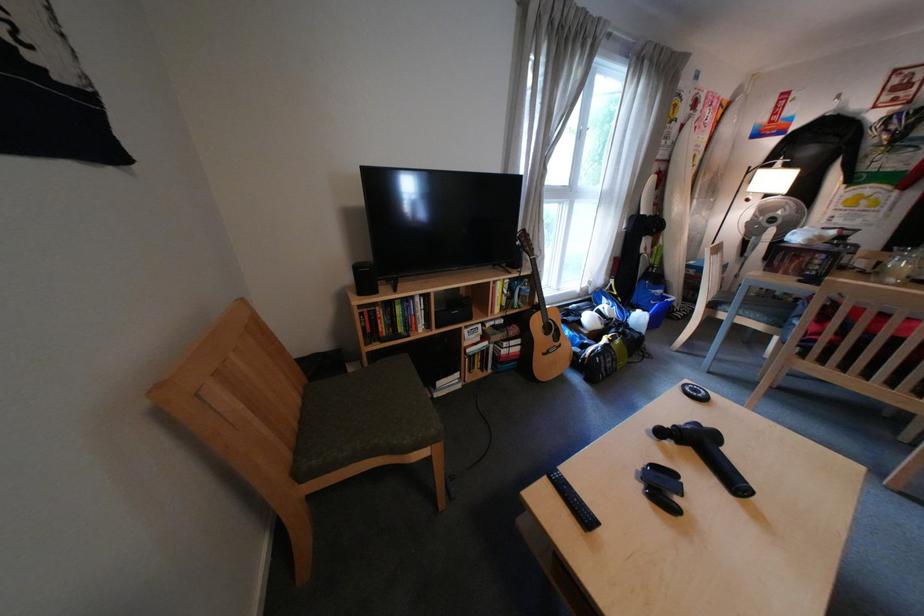
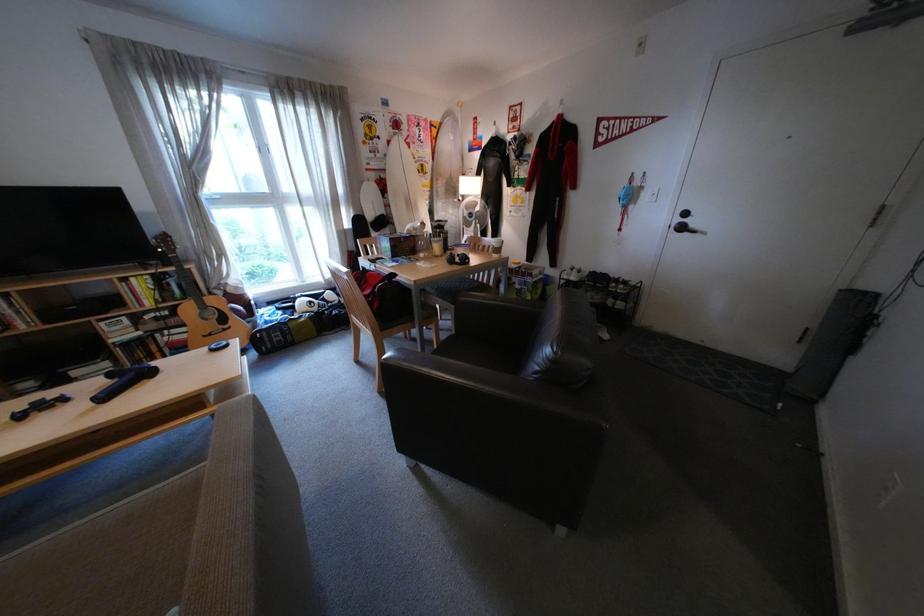
Where in the second image is the point corresponding to pixel 558 353 from the first image?

(220, 334)